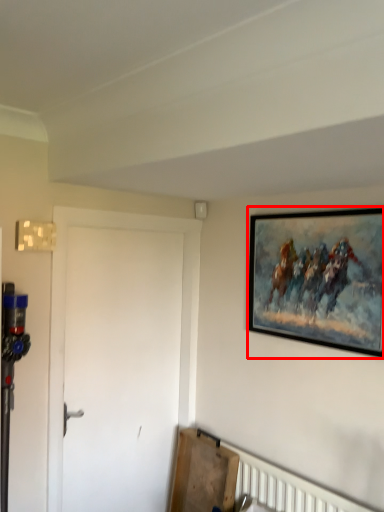
Question: From the image's perspective, where is picture frame (annotated by the red box) located relative to door?

Choices:
 (A) above
 (B) below

Answer: (A)